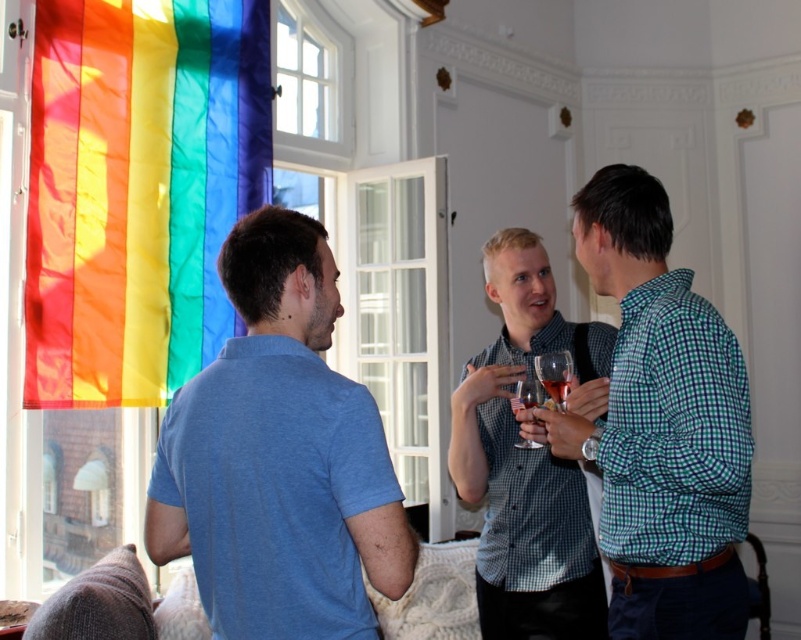
You are a photographer setting up for an event. You need to ensure that the rainbow fabric flag at left and the translucent glass wine glass at center are both visible in your shot. Given their sizes, which object will occupy more vertical space in the photo?

The rainbow fabric flag at left has a greater height compared to the translucent glass wine glass at center, so it will occupy more vertical space in the photo.

You are standing in the room and want to hang a new painting on the wall. The painting is 10 feet away from you. Is the rainbow fabric flag at left closer to you than the spot where you want to hang the painting?

The rainbow fabric flag at left is 9.54 feet away from the viewer, which is closer than the 10 feet distance to the spot where you want to hang the painting. Therefore, the flag is closer to you than the painting location.

In the scene shown: You are a photographer setting up for an event. You notice the rainbow fabric flag at left and the translucent glass wine glass at center. To ensure the wine glass is fully visible in your photo, which object should you avoid placing in front of it?

The rainbow fabric flag at left is positioned over the translucent glass wine glass at center, so you should avoid placing the rainbow fabric flag at left in front of the wine glass to ensure it remains visible.